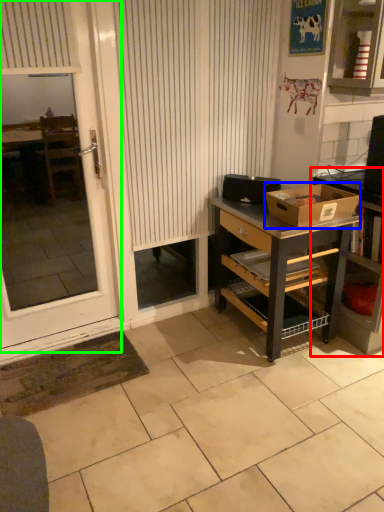
Question: Which object is positioned farthest from shelf (highlighted by a red box)? Select from box (highlighted by a blue box) and screen door (highlighted by a green box).

Choices:
 (A) box
 (B) screen door

Answer: (B)